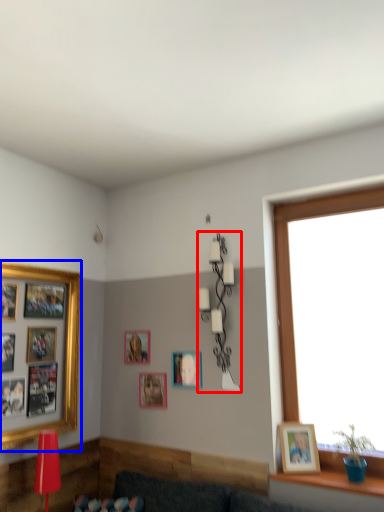
Question: Which object appears closest to the camera in this image, lamp (highlighted by a red box) or picture frame (highlighted by a blue box)?

Choices:
 (A) lamp
 (B) picture frame

Answer: (B)